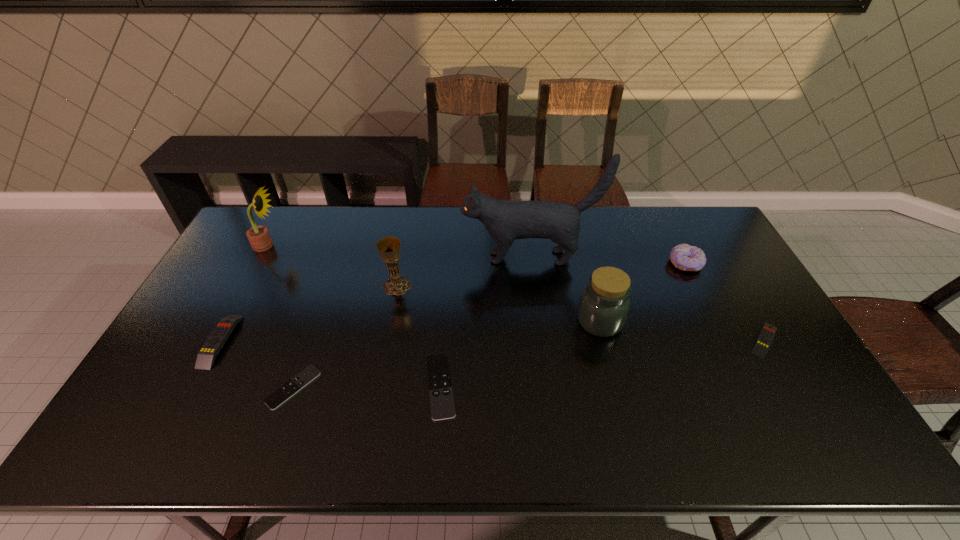
Where is `vacant point located between the right black remote control and the cat`? The width and height of the screenshot is (960, 540). vacant point located between the right black remote control and the cat is located at coordinates (485, 322).

Find the location of `free space that is in between the cat and the doughnut`. free space that is in between the cat and the doughnut is located at coordinates (608, 260).

Locate an element on the screen. This screenshot has height=540, width=960. free space between the smaller yellow remote control and the jar is located at coordinates (682, 330).

Locate an element on the screen. This screenshot has width=960, height=540. vacant space that is in between the green jar and the bigger yellow remote control is located at coordinates (410, 331).

Locate an element on the screen. free space between the second object from right to left and the cat is located at coordinates (608, 260).

Where is `free space between the cat and the brown doughnut`? The height and width of the screenshot is (540, 960). free space between the cat and the brown doughnut is located at coordinates (608, 260).

Find the location of `free area in between the tallest remote control and the third shortest object`. free area in between the tallest remote control and the third shortest object is located at coordinates [x=492, y=340].

Find the location of a particular element. The width and height of the screenshot is (960, 540). free spot between the fourth farthest object and the tallest remote control is located at coordinates (309, 313).

Find the location of a particular element. This screenshot has width=960, height=540. free spot between the green jar and the doughnut is located at coordinates (642, 292).

Select which object appears as the fifth closest to the tallest object. Please provide its 2D coordinates. Your answer should be formatted as a tuple, i.e. [(x, y)], where the tuple contains the x and y coordinates of a point satisfying the conditions above.

[(763, 342)]